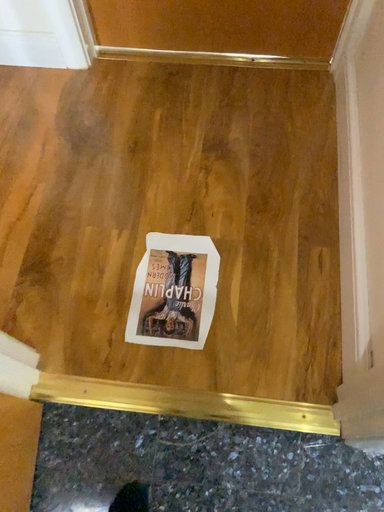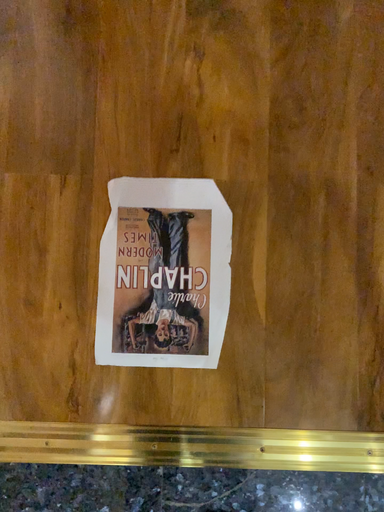
Question: How did the camera likely rotate when shooting the video?

Choices:
 (A) rotated upward
 (B) rotated downward

Answer: (B)